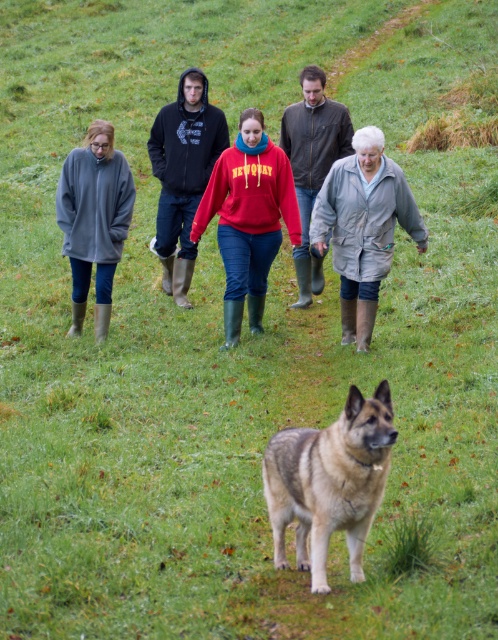
Question: Among these points, which one is nearest to the camera?

Choices:
 (A) (276, 524)
 (B) (264, 208)
 (C) (303, 214)
 (D) (188, 189)

Answer: (A)

Question: Can you confirm if matte gray sweater at upper center is bigger than red fleece sweatshirt at center?

Choices:
 (A) no
 (B) yes

Answer: (B)

Question: Does matte gray sweater at upper center have a larger size compared to brown fur dog at center?

Choices:
 (A) no
 (B) yes

Answer: (B)

Question: Among these points, which one is farthest from the camera?

Choices:
 (A) (82, 196)
 (B) (323, 280)
 (C) (285, 464)

Answer: (B)

Question: Does matte gray sweater at upper center appear under black hoodie at center?

Choices:
 (A) no
 (B) yes

Answer: (B)

Question: Which object appears closest to the camera in this image?

Choices:
 (A) gray matte jacket at center
 (B) brown fur dog at center
 (C) matte gray sweater at left
 (D) black hoodie at center

Answer: (B)